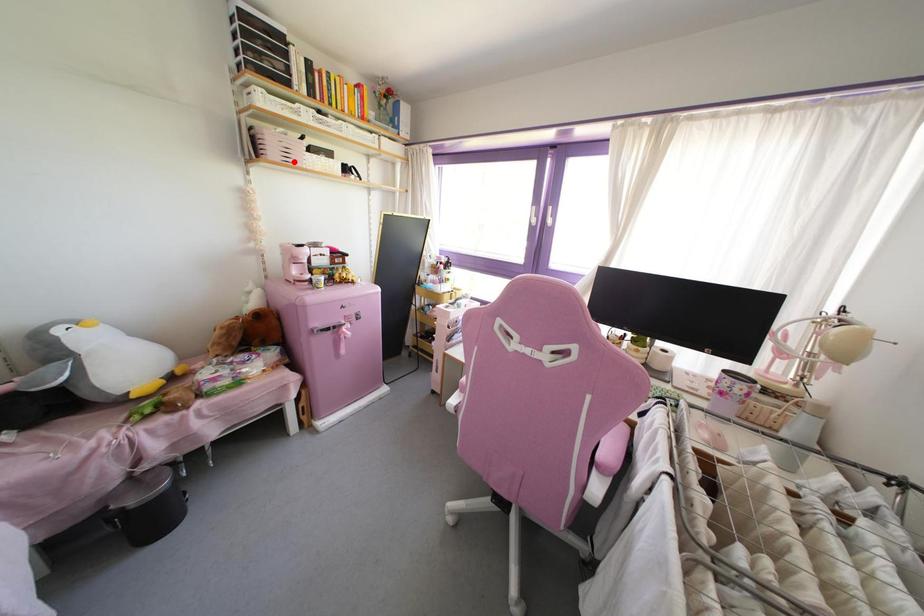
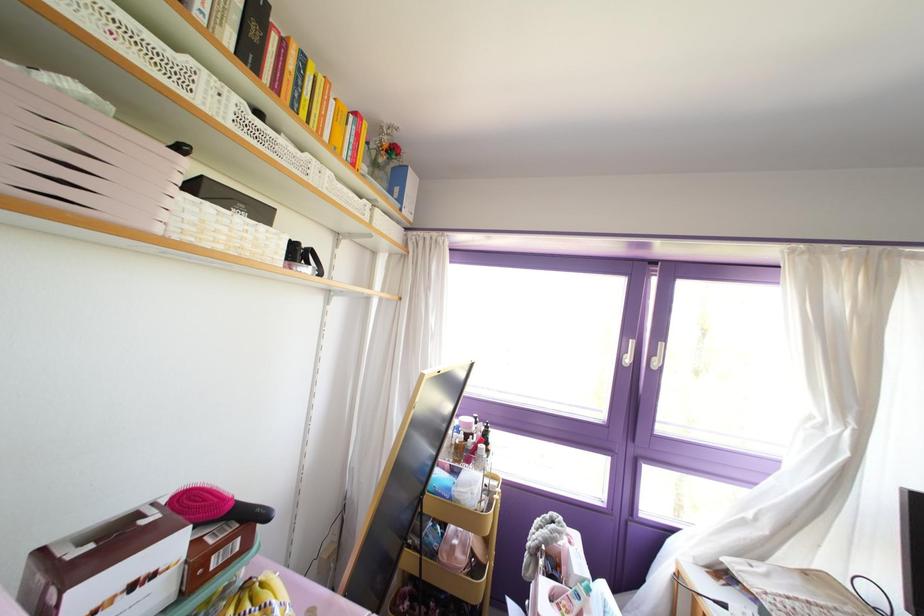
In the second image, find the point that corresponds to the highlighted location in the first image.

(107, 208)